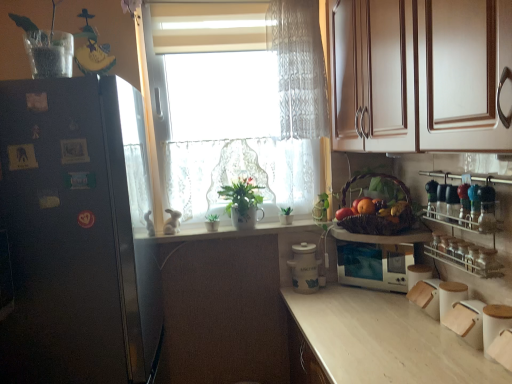
Measure the distance between point (343, 211) and camera.

They are 1.92 meters apart.

What do you see at coordinates (343, 213) in the screenshot? I see `shiny red apple at right, which is the 3th fruit in right-to-left order` at bounding box center [343, 213].

What do you see at coordinates (68, 235) in the screenshot? I see `black matte refrigerator at left` at bounding box center [68, 235].

Measure the distance between white lace curtain at center and camera.

white lace curtain at center is 6.09 feet away from camera.

What do you see at coordinates (398, 208) in the screenshot? I see `smooth yellow potato at lower right, which ranks as the 1th fruit in right-to-left order` at bounding box center [398, 208].

What do you see at coordinates (374, 265) in the screenshot? I see `white glossy microwave at center, the first appliance positioned from the right` at bounding box center [374, 265].

At what (x,y) coordinates should I click in order to perform the action: click on shiny red apple at right, the first fruit viewed from the left. Please return your answer as a coordinate pair (x, y). The height and width of the screenshot is (384, 512). Looking at the image, I should click on (343, 213).

Does green matte plant pot at center, which appears as the 2th houseplant when viewed from the right, have a greater height compared to orange matte at right, which ranks as the second fruit in left-to-right order?

Yes.

Can you tell me how much green matte plant pot at center, which is the second houseplant in left-to-right order, and orange matte at right, which ranks as the second fruit in left-to-right order, differ in facing direction?

The angle between the facing direction of green matte plant pot at center, which is the second houseplant in left-to-right order, and the facing direction of orange matte at right, which ranks as the second fruit in left-to-right order, is 48.4 degrees.

Is point (228, 192) farther from viewer compared to point (369, 201)?

Yes, point (228, 192) is farther from viewer.

Can you confirm if green matte plant pot at center, which appears as the 2th houseplant when viewed from the right, is wider than orange matte at right, which ranks as the second fruit in left-to-right order?

Yes, green matte plant pot at center, which appears as the 2th houseplant when viewed from the right, is wider than orange matte at right, which ranks as the second fruit in left-to-right order.

What are the coordinates of `the 1st houseplant counting from the left of the shiny red apple at right, the first fruit viewed from the left` in the screenshot? It's located at (286, 215).

Considering the sizes of green matte houseplant at center, which is counted as the third houseplant, starting from the left, and shiny red apple at right, which is the 3th fruit in right-to-left order, in the image, is green matte houseplant at center, which is counted as the third houseplant, starting from the left, taller or shorter than shiny red apple at right, which is the 3th fruit in right-to-left order,?

Considering their sizes, green matte houseplant at center, which is counted as the third houseplant, starting from the left, has more height than shiny red apple at right, which is the 3th fruit in right-to-left order.

Which is more to the right, green matte houseplant at center, which is counted as the third houseplant, starting from the left, or shiny red apple at right, which is the 3th fruit in right-to-left order?

shiny red apple at right, which is the 3th fruit in right-to-left order.

From a real-world perspective, between smooth yellow potato at lower right, which ranks as the 1th fruit in right-to-left order, and green matte houseplant at center, the third houseplant when ordered from right to left, who is vertically higher?

smooth yellow potato at lower right, which ranks as the 1th fruit in right-to-left order, from a real-world perspective.

In the scene shown: Which point is more distant from viewer, (400, 208) or (212, 217)?

The point (212, 217) is more distant.

Between smooth yellow potato at lower right, the third fruit positioned from the left, and green matte houseplant at center, the 1th houseplant viewed from the left, which one has larger size?

With larger size is green matte houseplant at center, the 1th houseplant viewed from the left.

Is green matte houseplant at center, the third houseplant when ordered from right to left, positioned with its back to brown woven basket at right?

No, green matte houseplant at center, the third houseplant when ordered from right to left, is not facing the opposite direction of brown woven basket at right.

Considering the relative sizes of green matte houseplant at center, the 1th houseplant viewed from the left, and brown woven basket at right in the image provided, is green matte houseplant at center, the 1th houseplant viewed from the left, bigger than brown woven basket at right?

No, green matte houseplant at center, the 1th houseplant viewed from the left, is not bigger than brown woven basket at right.

Is green matte houseplant at center, the third houseplant when ordered from right to left, to the left of brown woven basket at right from the viewer's perspective?

Yes.

Is green matte houseplant at center, the third houseplant when ordered from right to left, touching brown woven basket at right?

There is a gap between green matte houseplant at center, the third houseplant when ordered from right to left, and brown woven basket at right.

From the image's perspective, which one is positioned higher, green matte plant pot at center, which is the second houseplant in left-to-right order, or black matte refrigerator at left?

green matte plant pot at center, which is the second houseplant in left-to-right order, appears higher in the image.

Can you confirm if green matte plant pot at center, which appears as the 2th houseplant when viewed from the right, is wider than black matte refrigerator at left?

Incorrect, the width of green matte plant pot at center, which appears as the 2th houseplant when viewed from the right, does not surpass that of black matte refrigerator at left.

How many degrees apart are the facing directions of green matte plant pot at center, which appears as the 2th houseplant when viewed from the right, and black matte refrigerator at left?

There is a 90.3-degree angle between the facing directions of green matte plant pot at center, which appears as the 2th houseplant when viewed from the right, and black matte refrigerator at left.

Considering the sizes of objects green matte plant pot at center, which is the second houseplant in left-to-right order, and black matte refrigerator at left in the image provided, who is taller, green matte plant pot at center, which is the second houseplant in left-to-right order, or black matte refrigerator at left?

With more height is black matte refrigerator at left.

From the image's perspective, which one is positioned higher, white ceramic pots at center or green matte plant pot at center, which appears as the 2th houseplant when viewed from the right?

green matte plant pot at center, which appears as the 2th houseplant when viewed from the right.

Looking at the image, does white ceramic pots at center seem bigger or smaller compared to green matte plant pot at center, which appears as the 2th houseplant when viewed from the right?

white ceramic pots at center is smaller than green matte plant pot at center, which appears as the 2th houseplant when viewed from the right.

Is white ceramic pots at center surrounding green matte plant pot at center, which is the second houseplant in left-to-right order?

No, green matte plant pot at center, which is the second houseplant in left-to-right order, is not inside white ceramic pots at center.

Is white ceramic pots at center directly adjacent to green matte plant pot at center, which appears as the 2th houseplant when viewed from the right?

No, white ceramic pots at center is not next to green matte plant pot at center, which appears as the 2th houseplant when viewed from the right.

Can you tell me how much green matte plant pot at center, which is the second houseplant in left-to-right order, and smooth yellow potato at lower right, which ranks as the 1th fruit in right-to-left order, differ in facing direction?

43.4 degrees.

Based on the photo, is green matte plant pot at center, which is the second houseplant in left-to-right order, positioned before smooth yellow potato at lower right, which ranks as the 1th fruit in right-to-left order?

That is False.

Based on the photo, is green matte plant pot at center, which is the second houseplant in left-to-right order, far away from smooth yellow potato at lower right, the third fruit positioned from the left?

No.

What are the coordinates of `houseplant above the smooth yellow potato at lower right, the third fruit positioned from the left (from a real-world perspective)` in the screenshot? It's located at (242, 202).

Find the location of `the 2nd fruit in front of the green matte plant pot at center, which is the second houseplant in left-to-right order`. the 2nd fruit in front of the green matte plant pot at center, which is the second houseplant in left-to-right order is located at coordinates (366, 206).

The height and width of the screenshot is (384, 512). Identify the location of the 1st fruit located above the green matte houseplant at center, the 1th houseplant viewed from the right (from a real-world perspective). (343, 213).

Considering their positions, is orange matte at right, which ranks as the second fruit in left-to-right order, positioned further to smooth yellow potato at lower right, which ranks as the 1th fruit in right-to-left order, than green matte houseplant at center, the 1th houseplant viewed from the right?

Among the two, green matte houseplant at center, the 1th houseplant viewed from the right, is located further to smooth yellow potato at lower right, which ranks as the 1th fruit in right-to-left order.

Considering their positions, is clear glass spice rack at right positioned further to green matte houseplant at center, the 1th houseplant viewed from the right, than white glossy microwave at center, positioned as the 2th appliance in left-to-right order?

Among the two, clear glass spice rack at right is located further to green matte houseplant at center, the 1th houseplant viewed from the right.

Considering their positions, is brown woven basket at right positioned further to white glossy microwave at center, positioned as the 2th appliance in left-to-right order, than black matte refrigerator at left?

black matte refrigerator at left lies further to white glossy microwave at center, positioned as the 2th appliance in left-to-right order, than the other object.

Based on their spatial positions, is white ceramic jar at center, marked as the 1th appliance in a left-to-right arrangement, or green matte houseplant at center, which is counted as the third houseplant, starting from the left, further from clear glass spice rack at right?

Among the two, green matte houseplant at center, which is counted as the third houseplant, starting from the left, is located further to clear glass spice rack at right.

When comparing their distances from white lace curtain at center, does clear glass spice rack at right or green matte plant pot at center, which is the second houseplant in left-to-right order, seem closer?

Based on the image, green matte plant pot at center, which is the second houseplant in left-to-right order, appears to be nearer to white lace curtain at center.

Estimate the real-world distances between objects in this image. Which object is closer to white glossy microwave at center, positioned as the 2th appliance in left-to-right order, green matte plant pot at center, which is the second houseplant in left-to-right order, or green matte houseplant at center, the 1th houseplant viewed from the left?

The object closer to white glossy microwave at center, positioned as the 2th appliance in left-to-right order, is green matte plant pot at center, which is the second houseplant in left-to-right order.

From the image, which object appears to be farther from white glossy microwave at center, positioned as the 2th appliance in left-to-right order, green matte houseplant at center, which is counted as the third houseplant, starting from the left, or green matte plant pot at center, which appears as the 2th houseplant when viewed from the right?

Based on the image, green matte plant pot at center, which appears as the 2th houseplant when viewed from the right, appears to be further to white glossy microwave at center, positioned as the 2th appliance in left-to-right order.

From the picture: Which object lies further to the anchor point black matte refrigerator at left, brown woven basket at right or shiny red apple at right, the first fruit viewed from the left?

shiny red apple at right, the first fruit viewed from the left, lies further to black matte refrigerator at left than the other object.

Find the location of a particular element. The image size is (512, 384). countertop between white lace curtain at center and black matte refrigerator at left from top to bottom is located at coordinates (234, 232).

This screenshot has width=512, height=384. Find the location of `basket between black matte refrigerator at left and smooth yellow potato at lower right, the third fruit positioned from the left, from left to right`. basket between black matte refrigerator at left and smooth yellow potato at lower right, the third fruit positioned from the left, from left to right is located at coordinates (376, 212).

Identify the location of basket between white lace curtain at center and white ceramic jar at center, marked as the 1th appliance in a left-to-right arrangement, in the vertical direction. (376, 212).

Locate an element on the screen. The height and width of the screenshot is (384, 512). countertop located between black matte refrigerator at left and shiny red apple at right, the first fruit viewed from the left, in the left-right direction is located at coordinates (234, 232).